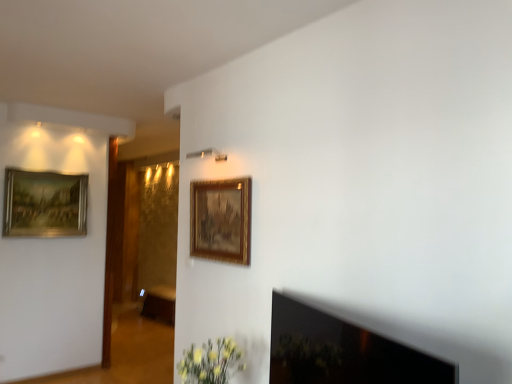
Question: Is brown wood cabinet at center surrounded by gold-framed painting at upper left, the 2th picture frame viewed from the right?

Choices:
 (A) no
 (B) yes

Answer: (A)

Question: Would you say gold-framed painting at upper left, which ranks as the first picture frame in back-to-front order, is outside brown wood cabinet at center?

Choices:
 (A) yes
 (B) no

Answer: (A)

Question: Does gold-framed painting at upper left, the second picture frame viewed from the front, appear on the left side of brown wood cabinet at center?

Choices:
 (A) yes
 (B) no

Answer: (A)

Question: From the image's perspective, is gold-framed painting at upper left, the 2th picture frame viewed from the right, over brown wood cabinet at center?

Choices:
 (A) yes
 (B) no

Answer: (A)

Question: From a real-world perspective, is gold-framed painting at upper left, the 2th picture frame viewed from the right, physically below brown wood cabinet at center?

Choices:
 (A) yes
 (B) no

Answer: (B)

Question: Is point (19, 183) closer or farther from the camera than point (170, 317)?

Choices:
 (A) closer
 (B) farther

Answer: (A)

Question: From a real-world perspective, relative to brown wood cabinet at center, is gold-framed painting at upper left, the second picture frame viewed from the front, vertically above or below?

Choices:
 (A) above
 (B) below

Answer: (A)

Question: In terms of width, does gold-framed painting at upper left, the 2th picture frame viewed from the right, look wider or thinner when compared to brown wood cabinet at center?

Choices:
 (A) wide
 (B) thin

Answer: (B)

Question: From the image's perspective, is gold-framed painting at upper left, the second picture frame viewed from the front, located above or below brown wood cabinet at center?

Choices:
 (A) below
 (B) above

Answer: (B)

Question: Is gold/gilded picture frame at upper center, which appears as the first picture frame when viewed from the right, situated inside brown wood cabinet at center or outside?

Choices:
 (A) inside
 (B) outside

Answer: (B)

Question: Based on their positions, is gold/gilded picture frame at upper center, the second picture frame in the left-to-right sequence, located to the left or right of brown wood cabinet at center?

Choices:
 (A) left
 (B) right

Answer: (B)

Question: From a real-world perspective, is gold/gilded picture frame at upper center, placed as the first picture frame when sorted from front to back, positioned above or below brown wood cabinet at center?

Choices:
 (A) below
 (B) above

Answer: (B)

Question: From the image's perspective, is gold/gilded picture frame at upper center, the 2th picture frame from the back, positioned above or below brown wood cabinet at center?

Choices:
 (A) below
 (B) above

Answer: (B)

Question: Is gold-framed painting at upper left, the second picture frame viewed from the front, wider or thinner than gold/gilded picture frame at upper center, the 2th picture frame from the back?

Choices:
 (A) wide
 (B) thin

Answer: (A)

Question: Relative to gold/gilded picture frame at upper center, the 2th picture frame from the back, is gold-framed painting at upper left, which ranks as the first picture frame in back-to-front order, in front or behind?

Choices:
 (A) front
 (B) behind

Answer: (B)